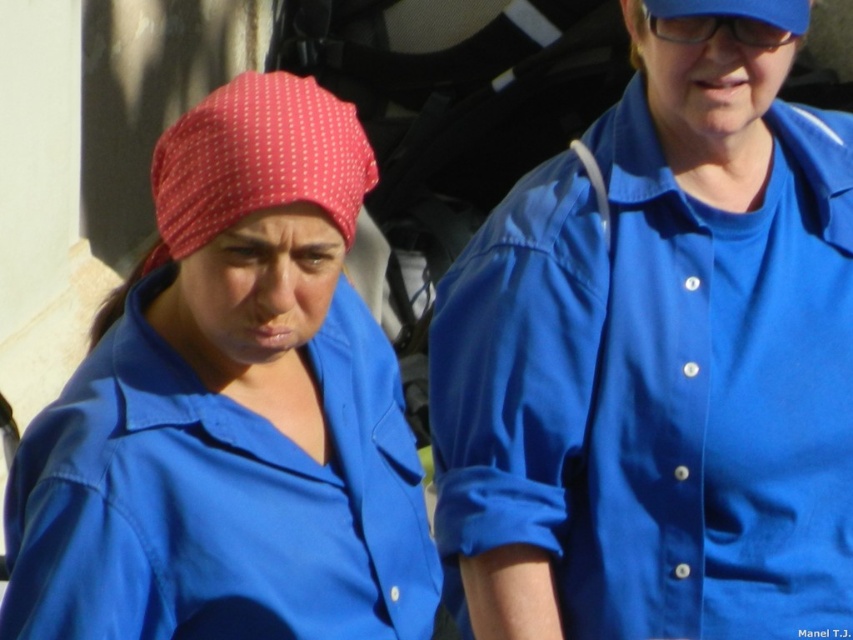
Is point (300, 131) positioned in front of point (158, 176)?

Yes.

Which is behind, point (390, 616) or point (345, 118)?

The point (390, 616) is behind.

Find the location of `matte blue shirt at center`. matte blue shirt at center is located at coordinates (231, 410).

Is blue smooth shirt at center below matte blue shirt at center?

Yes.

Between blue smooth shirt at center and matte blue shirt at center, which one is positioned higher?

matte blue shirt at center is higher up.

Describe the element at coordinates (656, 369) in the screenshot. I see `blue smooth shirt at center` at that location.

Find the location of a particular element. The image size is (853, 640). blue smooth shirt at center is located at coordinates (656, 369).

Does blue smooth shirt at center have a lesser width compared to blue fabric baseball cap at upper right?

Incorrect, blue smooth shirt at center's width is not less than blue fabric baseball cap at upper right's.

Does blue smooth shirt at center appear under blue fabric baseball cap at upper right?

Indeed, blue smooth shirt at center is positioned under blue fabric baseball cap at upper right.

Who is more distant from viewer, (552, 336) or (795, 19)?

Point (552, 336)

Find the location of a particular element. This screenshot has width=853, height=640. blue smooth shirt at center is located at coordinates (656, 369).